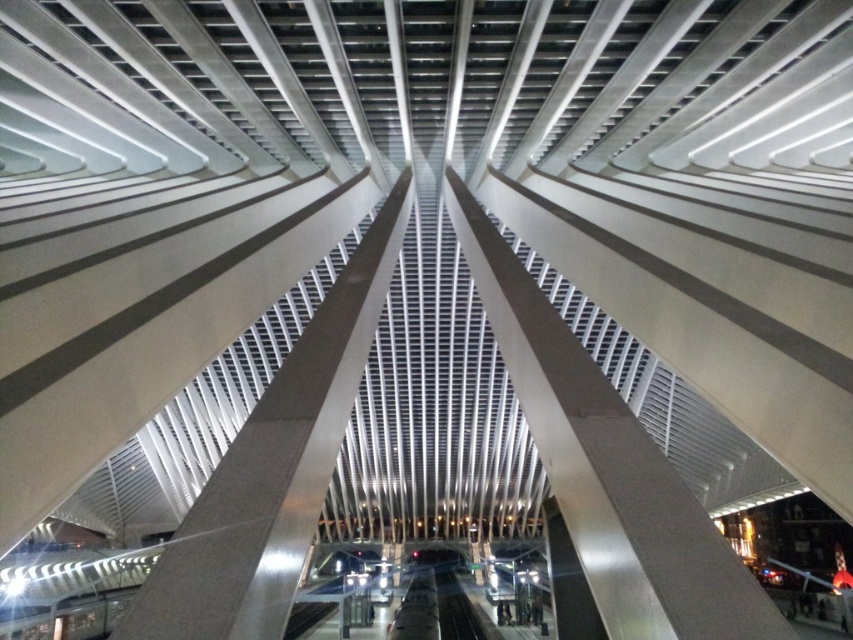
You are an architect inspecting the structural integrity of the beams in the image. You notice two beams at the center labeled as metallic silver beam at center and satin silver beam at center. Which beam has a greater width according to the description?

The metallic silver beam at center has a greater width than the satin silver beam at center according to the description.

You are standing in front of the architectural structure and notice two points marked on the beams. The first point is located at coordinates point (643, 536) and the second at point (241, 444). Which of these points appears closer to your viewpoint?

Point (643, 536) is closer to the camera than point (241, 444), so the first point appears closer to your viewpoint.

You are an architect designing a new installation and want to ensure safety between the two closest metallic beams. The safety regulation requires a minimum distance of 10 feet between any two beams. Based on the image, is the distance between the metallic silver beam at center and the other beam sufficient to meet the safety requirement?

The metallic silver beam at center and the other beam are 9.66 feet apart, which is less than the required 10 feet. Therefore, the distance does not meet the safety requirement.